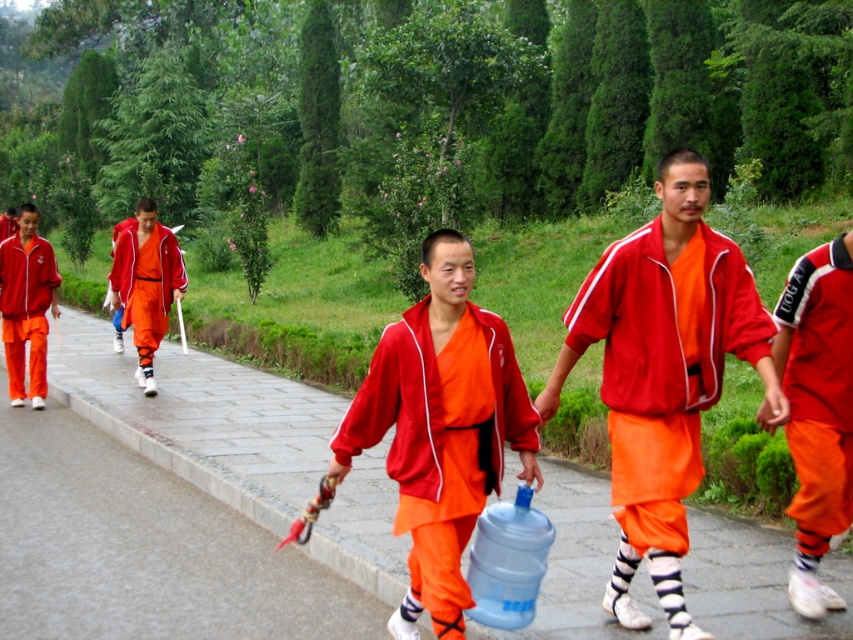
Question: Which object is farther from the camera taking this photo?

Choices:
 (A) matte red tracksuit at right
 (B) matte red jacket at center
 (C) matte orange robe at center

Answer: (C)

Question: Does smooth concrete pavement at center lie in front of matte orange fabric at center?

Choices:
 (A) yes
 (B) no

Answer: (B)

Question: Considering the relative positions of matte red jacket at center and matte red tracksuit at left in the image provided, where is matte red jacket at center located with respect to matte red tracksuit at left?

Choices:
 (A) below
 (B) above

Answer: (A)

Question: Which point appears closest to the camera in this image?

Choices:
 (A) (828, 486)
 (B) (364, 404)
 (C) (144, 288)
 (D) (26, 253)

Answer: (B)

Question: From the image, what is the correct spatial relationship of matte red jacket at center in relation to matte orange fabric at center?

Choices:
 (A) below
 (B) above

Answer: (B)

Question: Which object is the farthest from the smooth concrete pavement at center?

Choices:
 (A) matte orange fabric at center
 (B) matte red tracksuit at left
 (C) matte orange robe at center

Answer: (B)